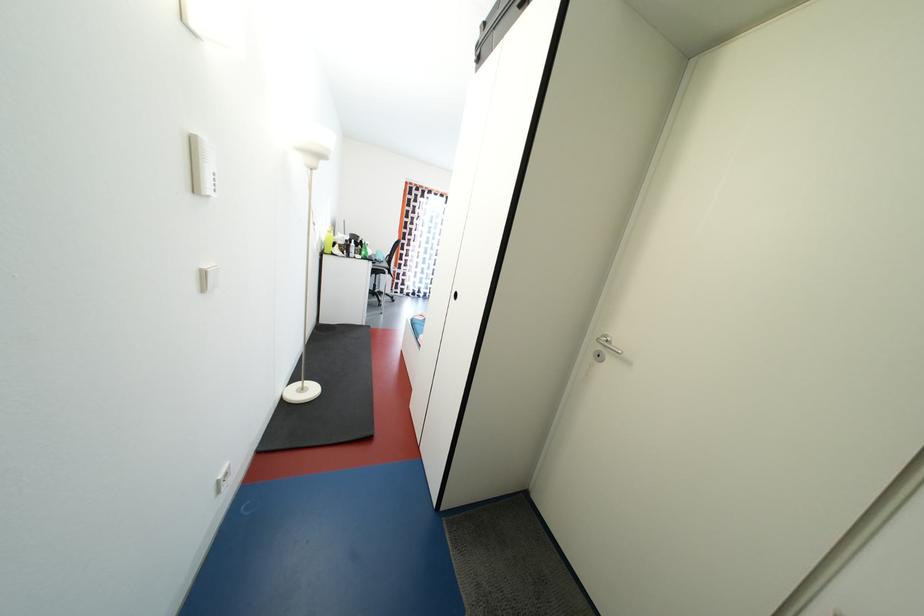
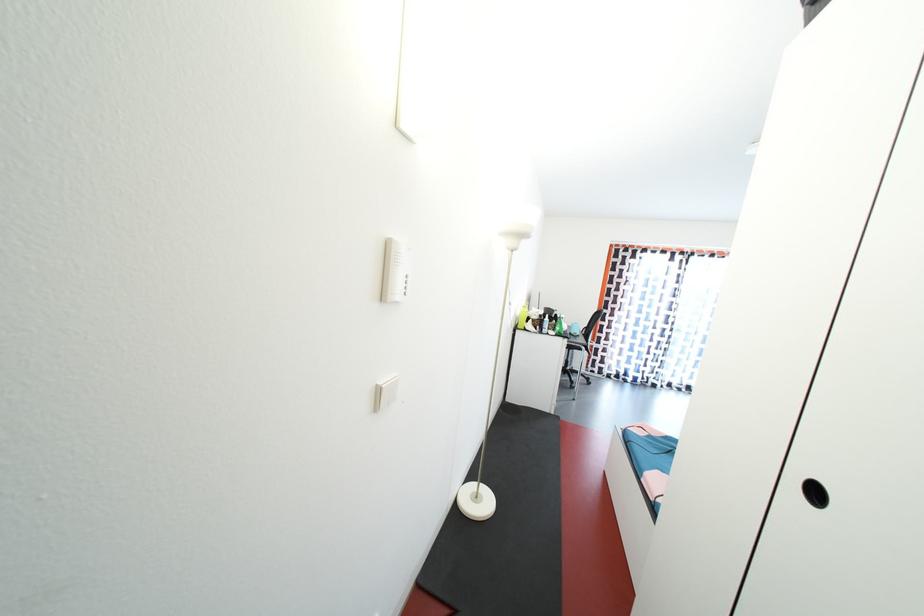
In the second image, find the point that corresponds to pixel 359 249 in the first image.

(553, 323)